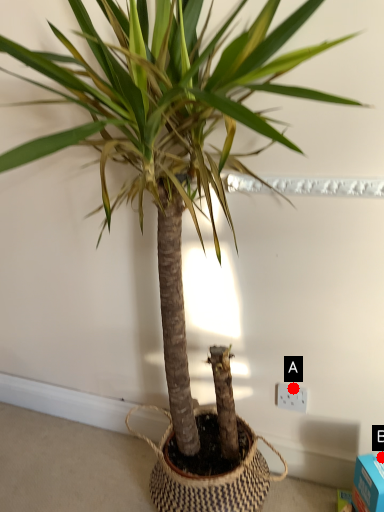
Question: Two points are circled on the image, labeled by A and B beside each circle. Among these points, which one is nearest to the camera?

Choices:
 (A) A is closer
 (B) B is closer

Answer: (B)